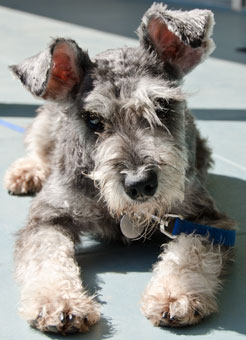
The width and height of the screenshot is (246, 340). In order to click on floor in this screenshot , I will do [x=227, y=90].